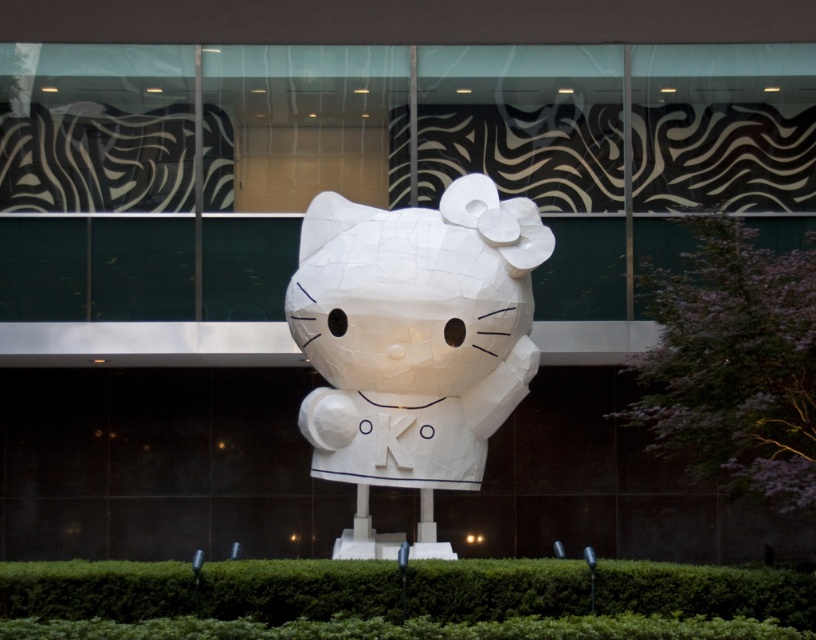
In the scene shown: You are a drone operator trying to capture a photo of the Hello Kitty sculpture. The green leafy hedge at center is blocking your view. Can you adjust your drone to the right or left to avoid the hedge? Please specify which direction to move based on the coordinates provided in the description.

The green leafy hedge at center is located at coordinates point (610,593). Since the hedge is at the center, moving the drone either to the left or right would help avoid it, but the exact direction depends on the coordinate system. However, without additional information about the coordinate system orientation, it is not possible to determine the exact direction to move.

You are a landscape architect designing a garden path between the green leafy hedge at center and the green leafy hedge at right. Which hedge should you place closer to the entrance if you want the path to be narrower near the entrance?

The green leafy hedge at right should be placed closer to the entrance because it is narrower than the green leafy hedge at center, allowing for a narrower path near the entrance.

You are a photographer planning to take a picture of the white paper sculpture at center and the green leafy hedge at right. From which side of the sculpture should you stand to ensure the hedge is visible in the background?

The white paper sculpture at center is positioned on the left side of the green leafy hedge at right, so you should stand to the right side of the sculpture to have the hedge visible in the background.